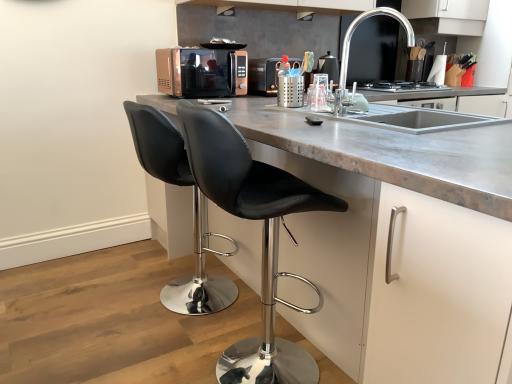
Locate an element on the screen. free location to the left of black leather stool at center, the first chair viewed from the front is located at coordinates (134, 356).